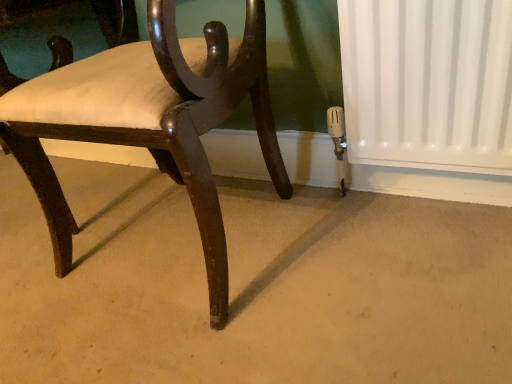
Describe the element at coordinates (148, 120) in the screenshot. The height and width of the screenshot is (384, 512). I see `glossy wood chair at lower left` at that location.

Find the location of a particular element. The width and height of the screenshot is (512, 384). glossy wood chair at lower left is located at coordinates (148, 120).

What are the coordinates of `glossy wood chair at lower left` in the screenshot? It's located at (148, 120).